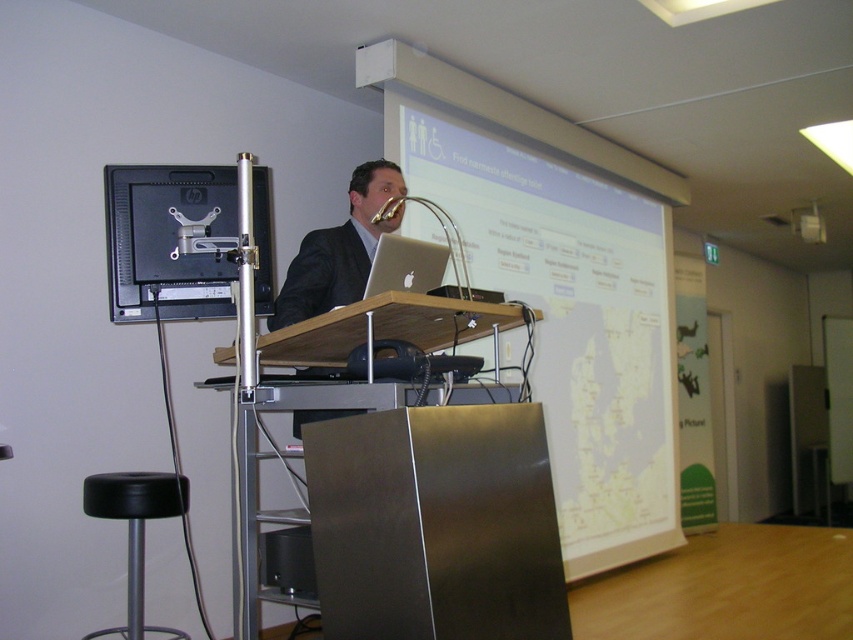
Question: Does black rubber stool at lower left have a lesser width compared to silver metallic laptop at center?

Choices:
 (A) yes
 (B) no

Answer: (B)

Question: Which object is farther from the camera taking this photo?

Choices:
 (A) white matte projection screen at center
 (B) black rubber stool at lower left

Answer: (A)

Question: Can you confirm if white matte projection screen at center is positioned to the right of black rubber stool at lower left?

Choices:
 (A) no
 (B) yes

Answer: (B)

Question: Estimate the real-world distances between objects in this image. Which object is closer to the black rubber stool at lower left?

Choices:
 (A) white matte projection screen at center
 (B) silver metallic laptop at center

Answer: (B)

Question: Is black rubber stool at lower left wider than silver metallic laptop at center?

Choices:
 (A) yes
 (B) no

Answer: (A)

Question: Among these objects, which one is nearest to the camera?

Choices:
 (A) metallic silver speaker at lower center
 (B) white matte projection screen at center
 (C) silver metallic laptop at center
 (D) black rubber stool at lower left

Answer: (A)